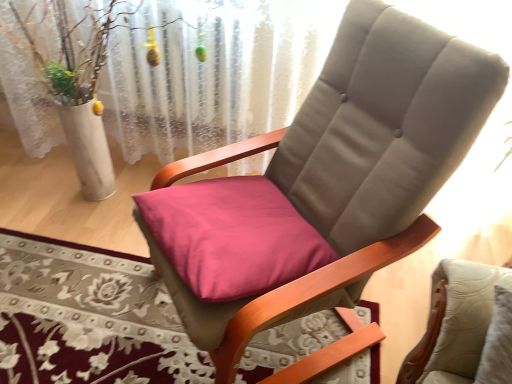
This screenshot has height=384, width=512. What do you see at coordinates (351, 166) in the screenshot? I see `suede-like beige chair at center` at bounding box center [351, 166].

This screenshot has width=512, height=384. Find the location of `suede-like beige chair at center`. suede-like beige chair at center is located at coordinates (351, 166).

Describe the element at coordinates (214, 73) in the screenshot. I see `white lace curtain at upper center` at that location.

Identify the location of suede-like beige chair at center. (351, 166).

From a real-world perspective, is suede-like beige chair at center positioned above or below pink fabric cushion at center?

suede-like beige chair at center is situated higher than pink fabric cushion at center in the real world.

Is point (282, 306) behind point (52, 353)?

That is False.

Identify the location of chair located on the right of pink fabric cushion at center. The image size is (512, 384). (351, 166).

Who is bigger, white lace curtain at upper center or suede-like beige chair at center?

suede-like beige chair at center.

From the picture: How many degrees apart are the facing directions of white lace curtain at upper center and suede-like beige chair at center?

The angle between the facing direction of white lace curtain at upper center and the facing direction of suede-like beige chair at center is 51.9 degrees.

Which is more to the right, white lace curtain at upper center or suede-like beige chair at center?

From the viewer's perspective, suede-like beige chair at center appears more on the right side.

Are white lace curtain at upper center and suede-like beige chair at center located far from each other?

No, white lace curtain at upper center is not far from suede-like beige chair at center.

Is white lace curtain at upper center bigger than pink fabric cushion at center?

Yes.

In the scene shown: From a real-world perspective, which is physically above, white lace curtain at upper center or pink fabric cushion at center?

From a 3D spatial view, white lace curtain at upper center is above.

From their relative heights in the image, would you say white lace curtain at upper center is taller or shorter than pink fabric cushion at center?

Considering their sizes, white lace curtain at upper center has more height than pink fabric cushion at center.

Considering the relative positions of white lace curtain at upper center and pink fabric cushion at center in the image provided, is white lace curtain at upper center to the left of pink fabric cushion at center from the viewer's perspective?

Correct, you'll find white lace curtain at upper center to the left of pink fabric cushion at center.

Which of these two, pink fabric cushion at center or white lace curtain at upper center, is thinner?

white lace curtain at upper center.

Would you say pink fabric cushion at center is a long distance from white lace curtain at upper center?

No, pink fabric cushion at center is not far from white lace curtain at upper center.

This screenshot has width=512, height=384. What are the coordinates of `mat directly beneath the white lace curtain at upper center (from a real-world perspective)` in the screenshot? It's located at (88, 318).

Does pink fabric cushion at center appear on the left side of white lace curtain at upper center?

No.

From the image's perspective, which is below, suede-like beige chair at center or white lace curtain at upper center?

suede-like beige chair at center.

Does point (330, 367) appear closer or farther from the camera than point (195, 64)?

Clearly, point (330, 367) is closer to the camera than point (195, 64).

Is white lace curtain at upper center surrounded by suede-like beige chair at center?

No, white lace curtain at upper center is not surrounded by suede-like beige chair at center.

Who is taller, suede-like beige chair at center or white lace curtain at upper center?

white lace curtain at upper center.

Consider the image. Can we say pink fabric cushion at center lies outside suede-like beige chair at center?

No, pink fabric cushion at center is not outside of suede-like beige chair at center.

Is pink fabric cushion at center to the left of suede-like beige chair at center from the viewer's perspective?

Yes.

Looking at their sizes, would you say pink fabric cushion at center is wider or thinner than suede-like beige chair at center?

pink fabric cushion at center is thinner than suede-like beige chair at center.

What are the coordinates of `chair in front of the pink fabric cushion at center` in the screenshot? It's located at (351, 166).

The width and height of the screenshot is (512, 384). I want to click on curtain that appears on the left of suede-like beige chair at center, so click(214, 73).

Looking at the image, which one is located further to pink fabric cushion at center, white lace curtain at upper center or suede-like beige chair at center?

white lace curtain at upper center is positioned further to the anchor pink fabric cushion at center.

Based on their spatial positions, is pink fabric cushion at center or suede-like beige chair at center closer to white lace curtain at upper center?

suede-like beige chair at center is positioned closer to the anchor white lace curtain at upper center.

Which object lies further to the anchor point suede-like beige chair at center, pink fabric cushion at center or white lace curtain at upper center?

white lace curtain at upper center lies further to suede-like beige chair at center than the other object.

Looking at the image, which one is located closer to pink fabric cushion at center, suede-like beige chair at center or white lace curtain at upper center?

Among the two, suede-like beige chair at center is located nearer to pink fabric cushion at center.

Looking at the image, which one is located further to white lace curtain at upper center, suede-like beige chair at center or pink fabric cushion at center?

Based on the image, pink fabric cushion at center appears to be further to white lace curtain at upper center.

When comparing their distances from suede-like beige chair at center, does white lace curtain at upper center or pink fabric cushion at center seem further?

white lace curtain at upper center lies further to suede-like beige chair at center than the other object.

This screenshot has height=384, width=512. What are the coordinates of `chair between white lace curtain at upper center and pink fabric cushion at center in the up-down direction` in the screenshot? It's located at (351, 166).